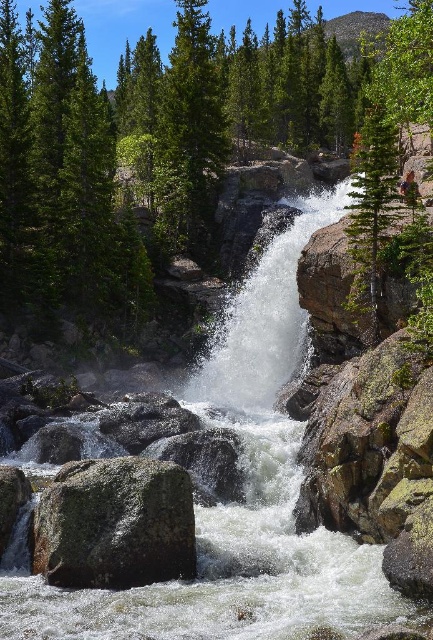
Does green textured tree at center have a greater height compared to green mossy rock at center?

Correct, green textured tree at center is much taller as green mossy rock at center.

Image resolution: width=433 pixels, height=640 pixels. Identify the location of green textured tree at center. (174, 132).

Looking at this image, who is higher up, green mossy rock at center or green matte tree at upper right?

Positioned higher is green matte tree at upper right.

Between green mossy rock at center and green matte tree at upper right, which one has more height?

green matte tree at upper right

Between point (78, 493) and point (354, 300), which one is positioned in front?

Point (78, 493) is more forward.

Where is `green mossy rock at center`? The image size is (433, 640). green mossy rock at center is located at coordinates (115, 524).

Who is positioned more to the left, green textured tree at center or green matte tree at upper right?

Positioned to the left is green textured tree at center.

Does green textured tree at center have a greater width compared to green matte tree at upper right?

Indeed, green textured tree at center has a greater width compared to green matte tree at upper right.

Is point (26, 19) less distant than point (358, 163)?

No, (26, 19) is further to viewer.

At what (x,y) coordinates should I click in order to perform the action: click on green textured tree at center. Please return your answer as a coordinate pair (x, y). Looking at the image, I should click on (174, 132).